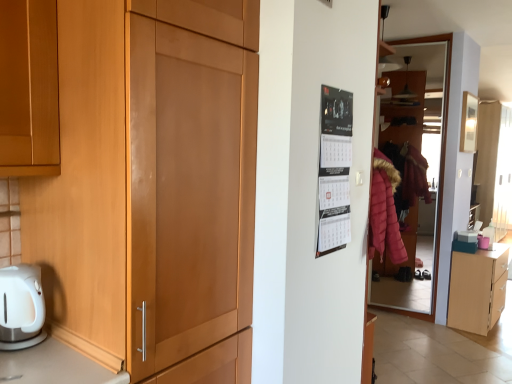
This screenshot has width=512, height=384. Describe the element at coordinates (335, 170) in the screenshot. I see `black paper calendar at upper right` at that location.

Measure the distance between matte glass door at right and camera.

matte glass door at right and camera are 3.15 meters apart.

Identify the location of light wood cabinet at lower right. The image size is (512, 384). (477, 289).

Identify the location of black paper calendar at upper right. The width and height of the screenshot is (512, 384). (335, 170).

Is black paper calendar at upper right completely or partially inside matte glass door at right?

No, black paper calendar at upper right is not inside matte glass door at right.

Is matte glass door at right turned away from black paper calendar at upper right?

No, matte glass door at right's orientation is not away from black paper calendar at upper right.

Can you confirm if matte glass door at right is smaller than black paper calendar at upper right?

Actually, matte glass door at right might be larger than black paper calendar at upper right.

Can you tell me how much matte glass door at right and black paper calendar at upper right differ in facing direction?

The angular difference between matte glass door at right and black paper calendar at upper right is 90.9 degrees.

Based on their sizes in the image, would you say black paper calendar at upper right is bigger or smaller than matte wood cupboard at left?

black paper calendar at upper right is smaller than matte wood cupboard at left.

Considering the relative sizes of black paper calendar at upper right and matte wood cupboard at left in the image provided, is black paper calendar at upper right taller than matte wood cupboard at left?

In fact, black paper calendar at upper right may be shorter than matte wood cupboard at left.

From the image's perspective, is black paper calendar at upper right beneath matte wood cupboard at left?

Incorrect, from the image's perspective, black paper calendar at upper right is higher than matte wood cupboard at left.

Looking at their sizes, would you say black paper calendar at upper right is wider or thinner than matte wood cupboard at left?

In the image, black paper calendar at upper right appears to be more narrow than matte wood cupboard at left.

Considering the sizes of matte wood cupboard at left and matte glass door at right in the image, is matte wood cupboard at left wider or thinner than matte glass door at right?

Clearly, matte wood cupboard at left has more width compared to matte glass door at right.

Would you say matte wood cupboard at left is inside or outside matte glass door at right?

Answer: matte wood cupboard at left is spatially situated outside matte glass door at right.

From a real-world perspective, is matte wood cupboard at left positioned above or below matte glass door at right?

matte wood cupboard at left is situated higher than matte glass door at right in the real world.

Which is in front, point (222, 376) or point (392, 134)?

The point (222, 376) is more forward.

Between matte wood cupboard at left and light wood cabinet at lower right, which one has less height?

Standing shorter between the two is light wood cabinet at lower right.

Looking at this image, is matte wood cupboard at left at the left side of light wood cabinet at lower right?

Yes.

Looking at this image, looking at their sizes, would you say matte wood cupboard at left is wider or thinner than light wood cabinet at lower right?

Clearly, matte wood cupboard at left has more width compared to light wood cabinet at lower right.

Consider the image. From a real-world perspective, which object stands above the other?

matte glass door at right.

Is matte glass door at right oriented towards light wood cabinet at lower right?

No, matte glass door at right is not oriented towards light wood cabinet at lower right.

In the scene shown: From the image's perspective, is matte glass door at right on light wood cabinet at lower right?

Indeed, from the image's perspective, matte glass door at right is shown above light wood cabinet at lower right.

Considering their positions, is matte glass door at right located in front of or behind light wood cabinet at lower right?

matte glass door at right is positioned farther from the viewer than light wood cabinet at lower right.

Is matte wood cupboard at left oriented away from black paper calendar at upper right?

No, black paper calendar at upper right is not at the back of matte wood cupboard at left.

What's the angular difference between matte wood cupboard at left and black paper calendar at upper right's facing directions?

The angle between the facing direction of matte wood cupboard at left and the facing direction of black paper calendar at upper right is 1.07 degrees.

Is matte wood cupboard at left closer to camera compared to black paper calendar at upper right?

Yes.

Between matte wood cupboard at left and black paper calendar at upper right, which one has larger width?

Wider between the two is matte wood cupboard at left.

From a real-world perspective, relative to matte glass door at right, is light wood cabinet at lower right vertically above or below?

light wood cabinet at lower right is below matte glass door at right.

Is light wood cabinet at lower right spatially inside matte glass door at right, or outside of it?

light wood cabinet at lower right is spatially situated outside matte glass door at right.

From the image's perspective, is light wood cabinet at lower right above or below matte glass door at right?

Clearly, from the image's perspective, light wood cabinet at lower right is below matte glass door at right.

Consider the image. Which is closer to the camera, (472,283) or (417,228)?

Point (472,283) is closer to the camera than point (417,228).

At what (x,y) coordinates should I click in order to perform the action: click on bulletin board above the matte glass door at right (from the image's perspective). Please return your answer as a coordinate pair (x, y). This screenshot has height=384, width=512. Looking at the image, I should click on (335, 170).

Where is `cupboard lying below the black paper calendar at upper right (from the image's perspective)`? cupboard lying below the black paper calendar at upper right (from the image's perspective) is located at coordinates (152, 188).

From the image, which object appears to be farther from matte glass door at right, matte wood cupboard at left or light wood cabinet at lower right?

matte wood cupboard at left lies further to matte glass door at right than the other object.

Based on their spatial positions, is matte wood cupboard at left or black paper calendar at upper right further from matte glass door at right?

Among the two, matte wood cupboard at left is located further to matte glass door at right.

From the image, which object appears to be nearer to matte glass door at right, black paper calendar at upper right or matte wood cupboard at left?

black paper calendar at upper right.

When comparing their distances from matte wood cupboard at left, does light wood cabinet at lower right or black paper calendar at upper right seem closer?

Among the two, black paper calendar at upper right is located nearer to matte wood cupboard at left.

Consider the image. Estimate the real-world distances between objects in this image. Which object is closer to light wood cabinet at lower right, matte wood cupboard at left or matte glass door at right?

Based on the image, matte glass door at right appears to be nearer to light wood cabinet at lower right.

Looking at the image, which one is located closer to black paper calendar at upper right, light wood cabinet at lower right or matte wood cupboard at left?

The object closer to black paper calendar at upper right is matte wood cupboard at left.

Looking at the image, which one is located closer to black paper calendar at upper right, matte wood cupboard at left or matte glass door at right?

matte wood cupboard at left lies closer to black paper calendar at upper right than the other object.

Which object lies further to the anchor point matte glass door at right, black paper calendar at upper right or light wood cabinet at lower right?

The object further to matte glass door at right is black paper calendar at upper right.

What are the coordinates of `bulletin board positioned between matte wood cupboard at left and matte glass door at right from near to far` in the screenshot? It's located at (335, 170).

At what (x,y) coordinates should I click in order to perform the action: click on cabinetry between matte wood cupboard at left and matte glass door at right along the z-axis. Please return your answer as a coordinate pair (x, y). Looking at the image, I should click on (477, 289).

Locate an element on the screen. Image resolution: width=512 pixels, height=384 pixels. cabinetry located between black paper calendar at upper right and matte glass door at right in the depth direction is located at coordinates (477, 289).

You are a GUI agent. You are given a task and a screenshot of the screen. Output one action in this format:
    pyautogui.click(x=<x>, y=<y>)
    Task: Click on the bulletin board situated between matte wood cupboard at left and light wood cabinet at lower right from left to right
    This screenshot has width=512, height=384.
    Given the screenshot: What is the action you would take?
    pyautogui.click(x=335, y=170)